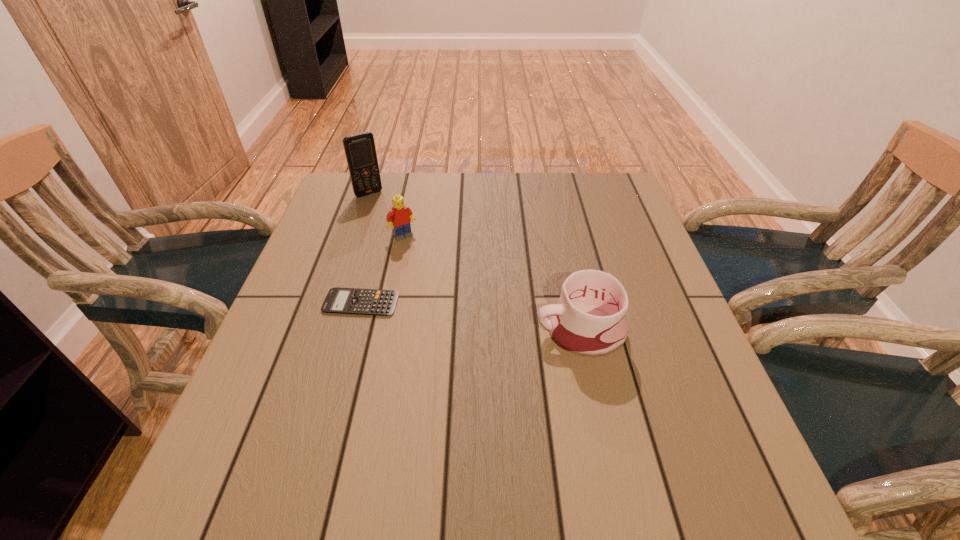
This screenshot has width=960, height=540. I want to click on free space on the desktop that is between the shortest object and the rightmost object and is positioned on the front-facing side of the third nearest object, so click(x=464, y=316).

Identify the location of vacant space on the desktop that is between the shortest object and the rightmost object and is positioned on the screen of the farthest object. The height and width of the screenshot is (540, 960). (462, 316).